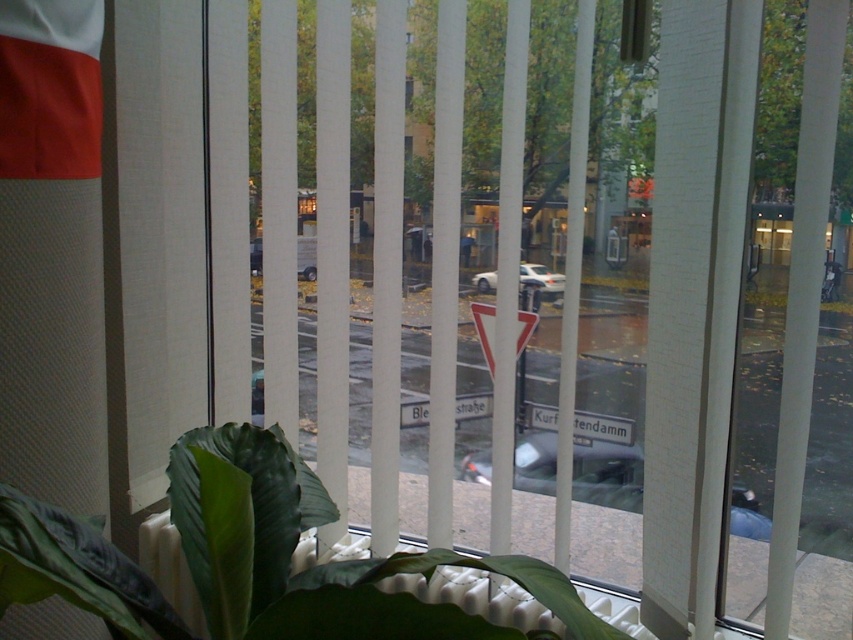
From the picture: Can you confirm if transparent glass door at right is positioned below green matte leafy plant at lower center?

Indeed, transparent glass door at right is positioned under green matte leafy plant at lower center.

The image size is (853, 640). Find the location of `transparent glass door at right`. transparent glass door at right is located at coordinates (795, 358).

The image size is (853, 640). Find the location of `transparent glass door at right`. transparent glass door at right is located at coordinates (795, 358).

This screenshot has height=640, width=853. I want to click on transparent glass door at right, so click(795, 358).

Based on the photo, does transparent glass door at right have a greater width compared to metallic silver car at center?

In fact, transparent glass door at right might be narrower than metallic silver car at center.

Which of these two, transparent glass door at right or metallic silver car at center, stands shorter?

Standing shorter between the two is metallic silver car at center.

Does point (762, 353) come behind point (627, 484)?

Yes, point (762, 353) is behind point (627, 484).

This screenshot has height=640, width=853. I want to click on transparent glass door at right, so pos(795,358).

Between metallic silver car at center and silver metallic car at center, which one is positioned higher?

silver metallic car at center is higher up.

Is metallic silver car at center positioned before silver metallic car at center?

Yes, it is in front of silver metallic car at center.

Does point (479, 476) lie behind point (538, 269)?

That is False.

Locate an element on the screen. This screenshot has height=640, width=853. metallic silver car at center is located at coordinates (607, 474).